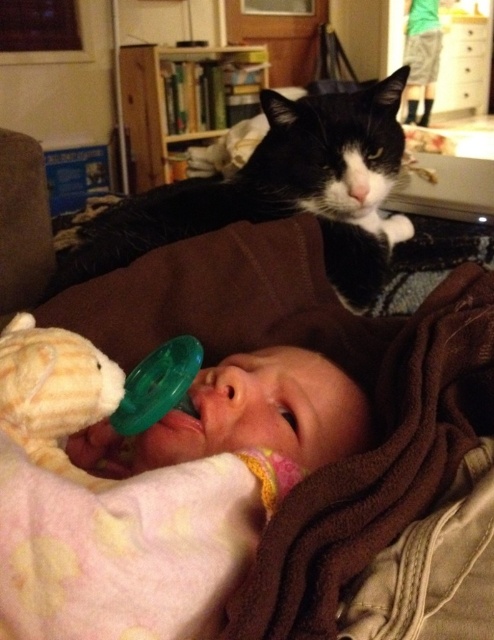
Question: Is pink soft fabric baby at center to the left of black fur cat at upper center from the viewer's perspective?

Choices:
 (A) yes
 (B) no

Answer: (B)

Question: Can you confirm if pink soft fabric baby at center is smaller than black fur cat at upper center?

Choices:
 (A) yes
 (B) no

Answer: (A)

Question: Which object is farther from the camera taking this photo?

Choices:
 (A) pink soft fabric baby at center
 (B) black fur cat at upper center

Answer: (B)

Question: Can you confirm if pink soft fabric baby at center is positioned to the right of black fur cat at upper center?

Choices:
 (A) yes
 (B) no

Answer: (A)